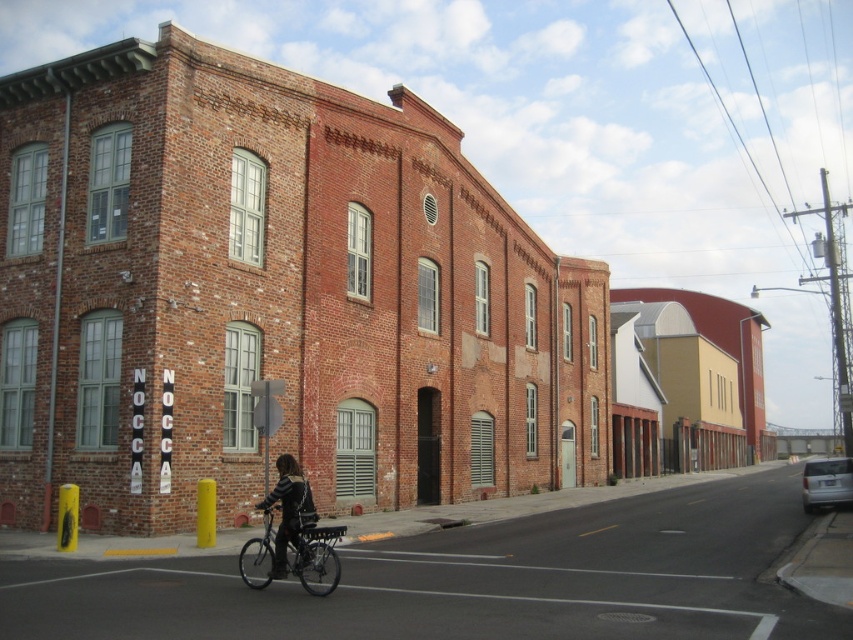
Which of these two, silver metallic bicycle at center or leather jacket at center, stands shorter?

Standing shorter between the two is silver metallic bicycle at center.

Which is below, silver metallic bicycle at center or leather jacket at center?

silver metallic bicycle at center is lower down.

Image resolution: width=853 pixels, height=640 pixels. Identify the location of silver metallic bicycle at center. (316, 557).